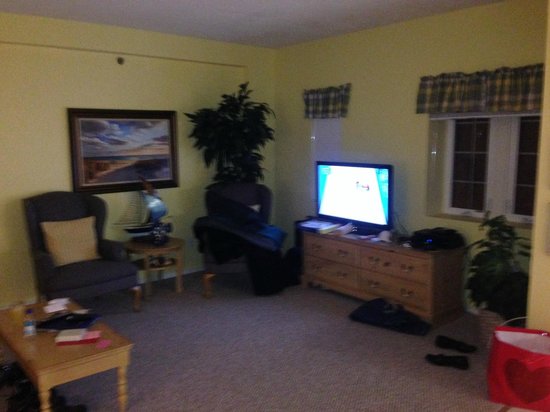
Where is `end table`? This screenshot has width=550, height=412. end table is located at coordinates (144, 246).